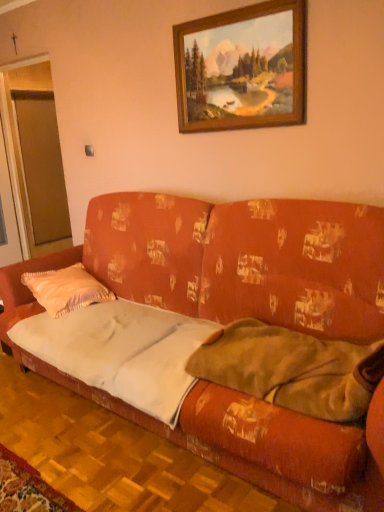
Question: Is white fabric sheet at center oriented away from satin peach pillow at left?

Choices:
 (A) yes
 (B) no

Answer: (B)

Question: Considering the relative sizes of white fabric sheet at center and satin peach pillow at left in the image provided, is white fabric sheet at center shorter than satin peach pillow at left?

Choices:
 (A) yes
 (B) no

Answer: (A)

Question: Does white fabric sheet at center have a larger size compared to satin peach pillow at left?

Choices:
 (A) no
 (B) yes

Answer: (B)

Question: Are white fabric sheet at center and satin peach pillow at left making contact?

Choices:
 (A) yes
 (B) no

Answer: (B)

Question: Is white fabric sheet at center to the right of satin peach pillow at left from the viewer's perspective?

Choices:
 (A) no
 (B) yes

Answer: (B)

Question: From the image's perspective, does white fabric sheet at center appear lower than satin peach pillow at left?

Choices:
 (A) no
 (B) yes

Answer: (B)

Question: From the image's perspective, is white fabric sheet at center under wooden picture frame at upper center?

Choices:
 (A) yes
 (B) no

Answer: (A)

Question: From a real-world perspective, is white fabric sheet at center physically above wooden picture frame at upper center?

Choices:
 (A) yes
 (B) no

Answer: (B)

Question: Is white fabric sheet at center looking in the opposite direction of wooden picture frame at upper center?

Choices:
 (A) yes
 (B) no

Answer: (B)

Question: Does white fabric sheet at center appear on the right side of wooden picture frame at upper center?

Choices:
 (A) yes
 (B) no

Answer: (B)

Question: From the image's perspective, would you say white fabric sheet at center is positioned over wooden picture frame at upper center?

Choices:
 (A) yes
 (B) no

Answer: (B)

Question: Does white fabric sheet at center have a larger size compared to wooden picture frame at upper center?

Choices:
 (A) no
 (B) yes

Answer: (B)

Question: From a real-world perspective, does soft green blanket at right sit lower than transparent glass door at left?

Choices:
 (A) yes
 (B) no

Answer: (A)